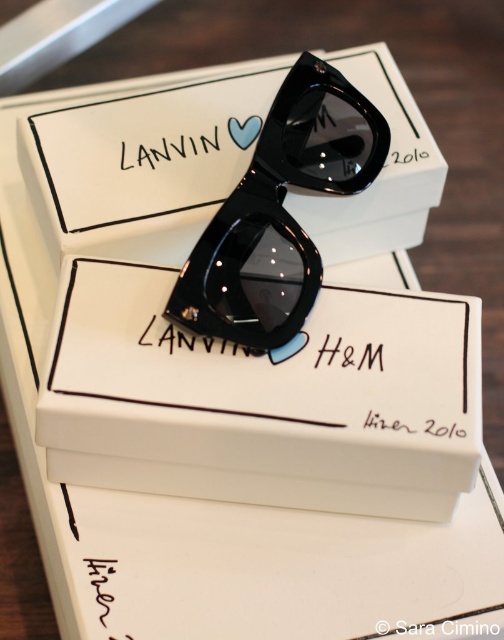
Question: Does white cardboard box at center have a lesser width compared to white cardboard box at upper center?

Choices:
 (A) no
 (B) yes

Answer: (B)

Question: Which of these objects is positioned closest to the white cardboard box at upper center?

Choices:
 (A) white cardboard box at center
 (B) glossy black sunglasses at center

Answer: (B)

Question: Does white cardboard box at center have a lesser width compared to glossy black sunglasses at center?

Choices:
 (A) yes
 (B) no

Answer: (B)

Question: Among these objects, which one is farthest from the camera?

Choices:
 (A) glossy black sunglasses at center
 (B) white cardboard box at upper center

Answer: (B)

Question: Which point is farther from the camera taking this photo?

Choices:
 (A) (115, 154)
 (B) (205, 390)

Answer: (A)

Question: Is white cardboard box at center thinner than glossy black sunglasses at center?

Choices:
 (A) yes
 (B) no

Answer: (B)